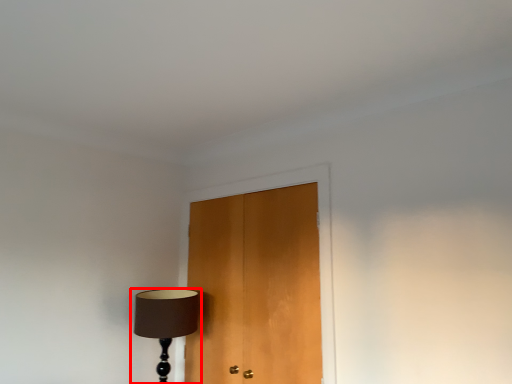
Question: In this image, where is lamp (annotated by the red box) located relative to door?

Choices:
 (A) right
 (B) left

Answer: (B)